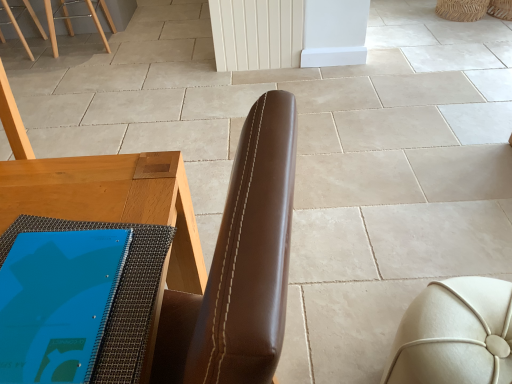
The image size is (512, 384). Describe the element at coordinates (146, 265) in the screenshot. I see `brown leather chair at center` at that location.

Measure the distance between brown leather chair at center and camera.

23.89 inches.

At what (x,y) coordinates should I click in order to perform the action: click on brown leather chair at center. Please return your answer as a coordinate pair (x, y). This screenshot has width=512, height=384. Looking at the image, I should click on (146, 265).

Describe the element at coordinates (455, 334) in the screenshot. I see `white leather ottoman at lower right` at that location.

At what (x,y) coordinates should I click in order to perform the action: click on white leather ottoman at lower right. Please return your answer as a coordinate pair (x, y). The width and height of the screenshot is (512, 384). Looking at the image, I should click on (455, 334).

Where is `brown leather chair at center`? brown leather chair at center is located at coordinates (146, 265).

Considering the positions of objects brown leather chair at center and white leather ottoman at lower right in the image provided, who is more to the left, brown leather chair at center or white leather ottoman at lower right?

brown leather chair at center is more to the left.

Is brown leather chair at center in front of white leather ottoman at lower right?

Yes.

Is point (138, 360) closer to viewer compared to point (463, 320)?

Yes.

From the image's perspective, is brown leather chair at center located above or below white leather ottoman at lower right?

From the image's perspective, brown leather chair at center appears above white leather ottoman at lower right.

Consider the image. From a real-world perspective, which object stands above the other?

In real-world perspective, brown leather chair at center is above.

Considering the relative sizes of brown leather chair at center and white leather ottoman at lower right in the image provided, is brown leather chair at center wider than white leather ottoman at lower right?

Indeed, brown leather chair at center has a greater width compared to white leather ottoman at lower right.

From their relative heights in the image, would you say brown leather chair at center is taller or shorter than white leather ottoman at lower right?

In the image, brown leather chair at center appears to be taller than white leather ottoman at lower right.

Considering the relative sizes of brown leather chair at center and white leather ottoman at lower right in the image provided, is brown leather chair at center smaller than white leather ottoman at lower right?

No.

Is white leather ottoman at lower right inside brown leather chair at center?

No, white leather ottoman at lower right is not a part of brown leather chair at center.

Is brown leather chair at center next to white leather ottoman at lower right and touching it?

brown leather chair at center and white leather ottoman at lower right are not in contact.

Is brown leather chair at center aimed at white leather ottoman at lower right?

No, brown leather chair at center is not facing towards white leather ottoman at lower right.

How far apart are brown leather chair at center and white leather ottoman at lower right?

brown leather chair at center and white leather ottoman at lower right are 65.66 centimeters apart from each other.

You are a GUI agent. You are given a task and a screenshot of the screen. Output one action in this format:
    pyautogui.click(x=<x>, y=<y>)
    Task: Click on the chair that is in front of the white leather ottoman at lower right
    
    Given the screenshot: What is the action you would take?
    pyautogui.click(x=146, y=265)

Considering the relative positions of white leather ottoman at lower right and brown leather chair at center in the image provided, is white leather ottoman at lower right to the left or to the right of brown leather chair at center?

Clearly, white leather ottoman at lower right is on the right of brown leather chair at center in the image.

Considering the positions of objects white leather ottoman at lower right and brown leather chair at center in the image provided, who is in front, white leather ottoman at lower right or brown leather chair at center?

brown leather chair at center is more forward.

Does point (464, 345) lie in front of point (194, 339)?

No, (464, 345) is further to viewer.

From the picture: From the image's perspective, relative to brown leather chair at center, is white leather ottoman at lower right above or below?

white leather ottoman at lower right is situated lower than brown leather chair at center in the image.

From a real-world perspective, is white leather ottoman at lower right below brown leather chair at center?

Yes, from a real-world perspective, white leather ottoman at lower right is below brown leather chair at center.

Looking at their sizes, would you say white leather ottoman at lower right is wider or thinner than brown leather chair at center?

Clearly, white leather ottoman at lower right has less width compared to brown leather chair at center.

Who is taller, white leather ottoman at lower right or brown leather chair at center?

brown leather chair at center.

Considering the relative sizes of white leather ottoman at lower right and brown leather chair at center in the image provided, is white leather ottoman at lower right bigger than brown leather chair at center?

Actually, white leather ottoman at lower right might be smaller than brown leather chair at center.

Is white leather ottoman at lower right situated inside brown leather chair at center or outside?

white leather ottoman at lower right cannot be found inside brown leather chair at center.

Is there a large distance between white leather ottoman at lower right and brown leather chair at center?

No.

Is white leather ottoman at lower right looking in the opposite direction of brown leather chair at center?

white leather ottoman at lower right does not have its back to brown leather chair at center.

What's the angular difference between white leather ottoman at lower right and brown leather chair at center's facing directions?

There is a 83.7-degree angle between the facing directions of white leather ottoman at lower right and brown leather chair at center.

Consider the image. How distant is white leather ottoman at lower right from brown leather chair at center?

25.85 inches.

Where is `furniture behind the brown leather chair at center`? The image size is (512, 384). furniture behind the brown leather chair at center is located at coordinates (455, 334).

At what (x,y) coordinates should I click in order to perform the action: click on chair above the white leather ottoman at lower right (from the image's perspective). Please return your answer as a coordinate pair (x, y). This screenshot has width=512, height=384. Looking at the image, I should click on (146, 265).

Locate an element on the screen. furniture located on the right of brown leather chair at center is located at coordinates (455, 334).